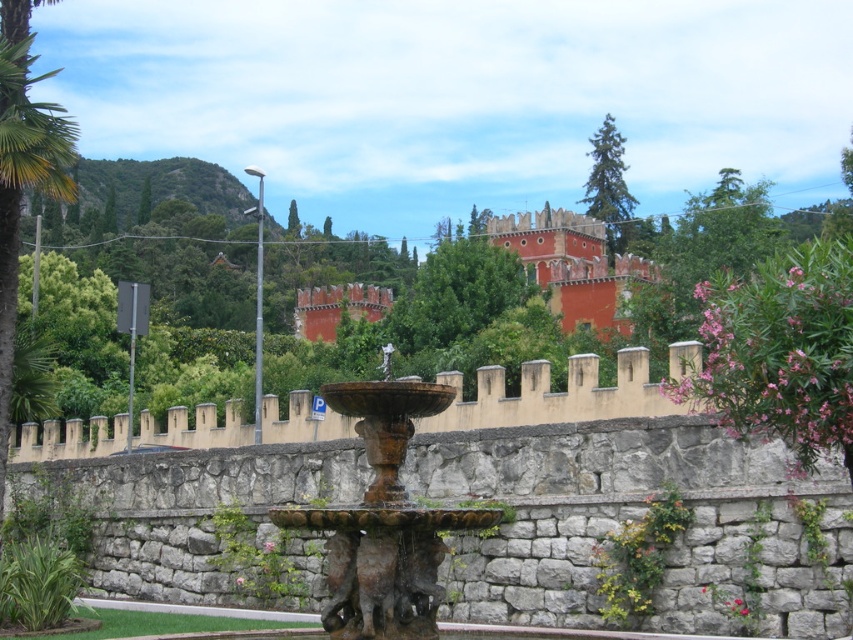
Question: Considering the relative positions of rusty stone fountain at center and green leafy tree at center in the image provided, where is rusty stone fountain at center located with respect to green leafy tree at center?

Choices:
 (A) above
 (B) below

Answer: (B)

Question: Is pink leafy bush at right positioned in front of terracotta stone palace at center?

Choices:
 (A) no
 (B) yes

Answer: (B)

Question: Estimate the real-world distances between objects in this image. Which object is farther from the terracotta stone palace at center?

Choices:
 (A) red matte stone castle at upper center
 (B) green leafy tree at center
 (C) pink leafy bush at right
 (D) rusty stone fountain at center

Answer: (D)

Question: Which of the following is the farthest from the observer?

Choices:
 (A) (318, 333)
 (B) (718, 396)
 (C) (595, 186)

Answer: (C)

Question: Which object appears farthest from the camera in this image?

Choices:
 (A) rusty stone fountain at center
 (B) green leafy tree at center

Answer: (B)

Question: Can you confirm if rusty stone fountain at center is positioned above green textured tree at upper center?

Choices:
 (A) no
 (B) yes

Answer: (A)